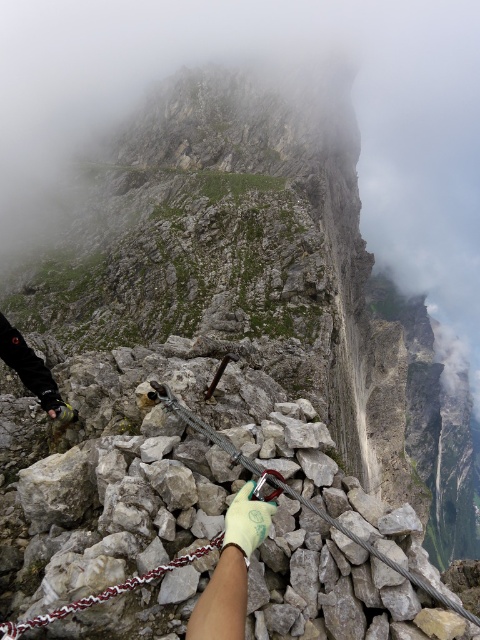
You are a mountain climber preparing to ascend a via ferrata route. You notice two gloves in the image, a green rubber glove at center and a green fabric glove at center. Which glove is positioned to the left when viewed from your perspective?

The green rubber glove at center is to the left of the green fabric glove at center.

You are a mountain climber looking at the black leather glove at lower left and the green fabric glove at center. Which glove is closer to your face?

The black leather glove at lower left is closer to your face because it is positioned further to the viewer than the green fabric glove at center.